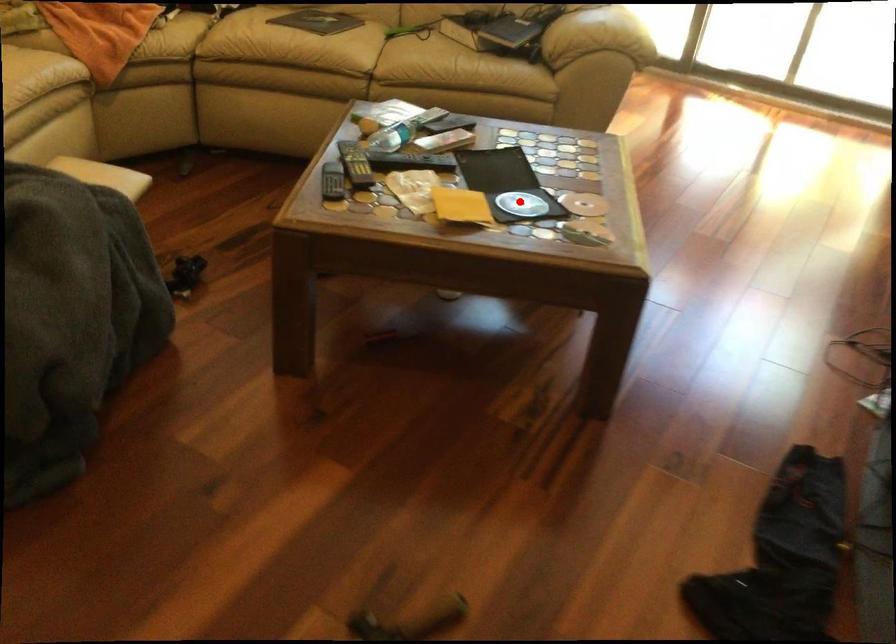
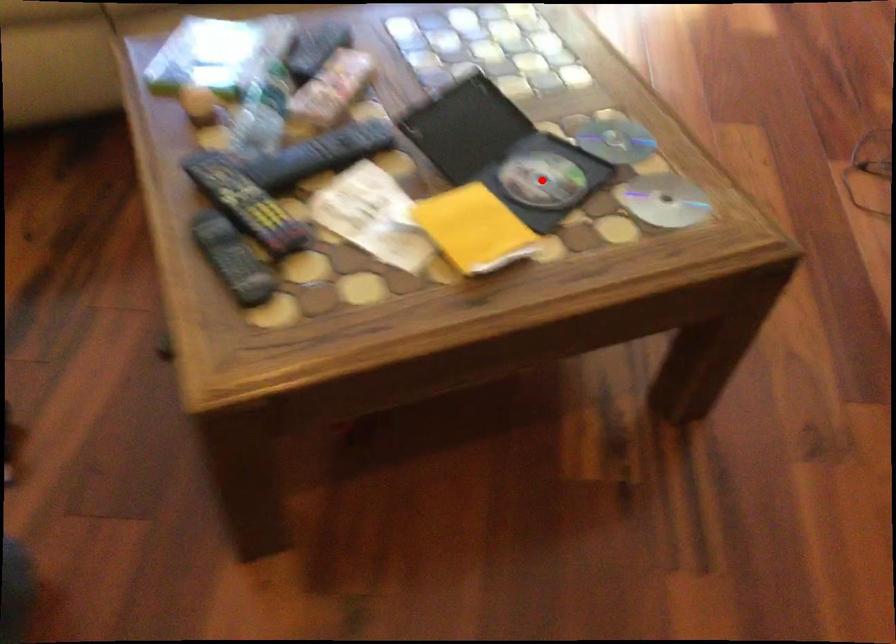
I am providing you with two images of the same scene from different viewpoints. A red point is marked on the first image and another point is marked on the second image. Is the red point in image1 aligned with the point shown in image2?

Yes